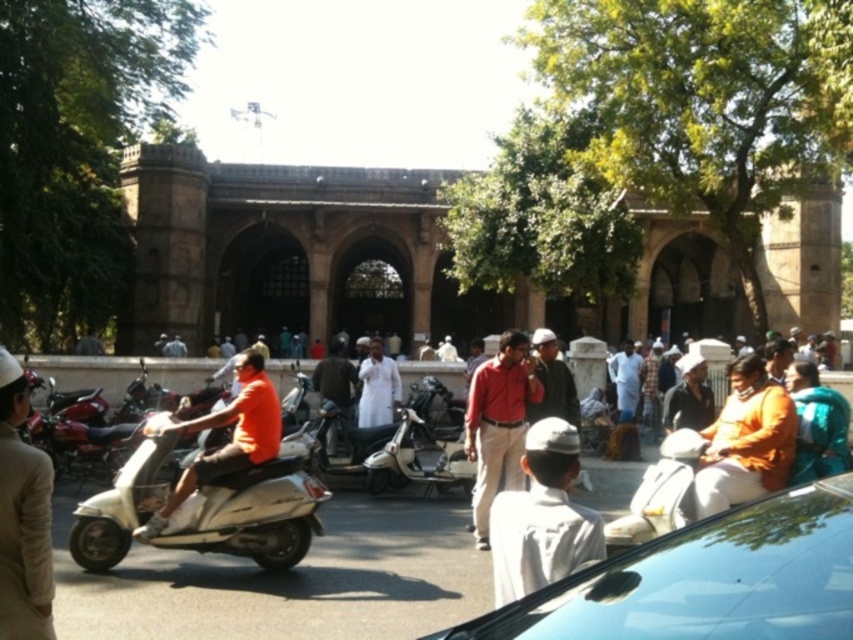
Is shiny blue car at lower right above light beige cotton shirt at left?

Actually, shiny blue car at lower right is below light beige cotton shirt at left.

Which is behind, point (593, 573) or point (33, 579)?

Point (33, 579)

At what (x,y) coordinates should I click in order to perform the action: click on shiny blue car at lower right. Please return your answer as a coordinate pair (x, y). The width and height of the screenshot is (853, 640). Looking at the image, I should click on (705, 579).

Locate an element on the screen. This screenshot has width=853, height=640. shiny blue car at lower right is located at coordinates (705, 579).

Does point (265, 534) come closer to viewer compared to point (363, 422)?

Yes.

Is white glossy scooter at center positioned behind white cotton shirt at center?

That is False.

Which is behind, point (148, 440) or point (379, 355)?

The point (379, 355) is more distant.

Locate an element on the screen. Image resolution: width=853 pixels, height=640 pixels. white glossy scooter at center is located at coordinates (251, 513).

The image size is (853, 640). Describe the element at coordinates (230, 440) in the screenshot. I see `orange t-shirt at center` at that location.

You are a GUI agent. You are given a task and a screenshot of the screen. Output one action in this format:
    pyautogui.click(x=<x>, y=<y>)
    Task: Click on the orange t-shirt at center
    The image size is (853, 640).
    Given the screenshot: What is the action you would take?
    pyautogui.click(x=230, y=440)

Image resolution: width=853 pixels, height=640 pixels. I want to click on orange t-shirt at center, so click(x=230, y=440).